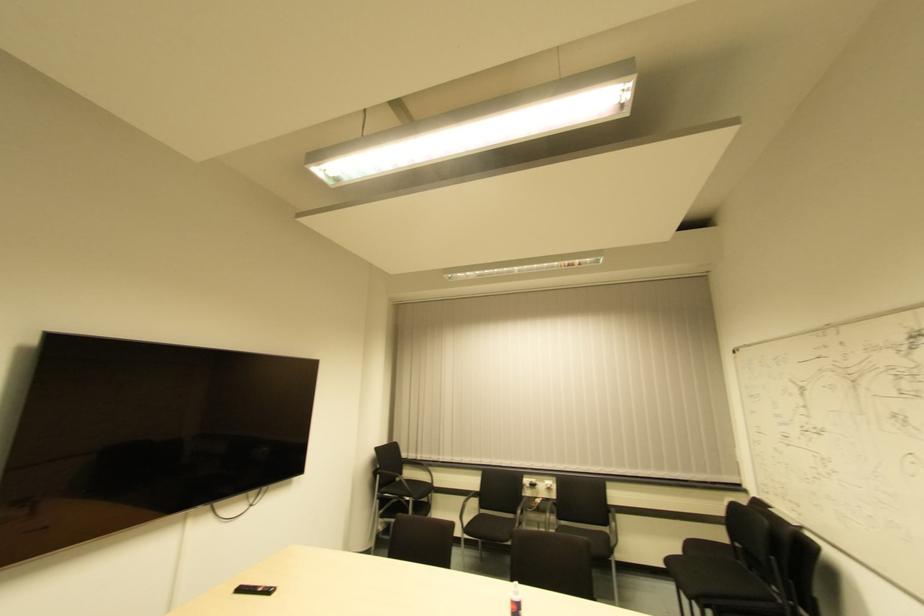
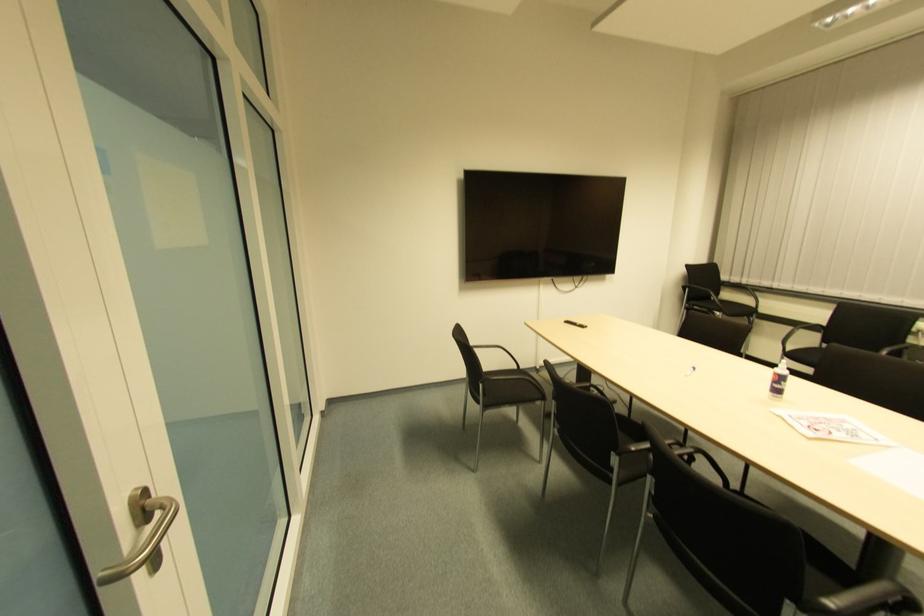
Find the pixel in the second image that matches pixel 377 495 in the first image.

(685, 306)